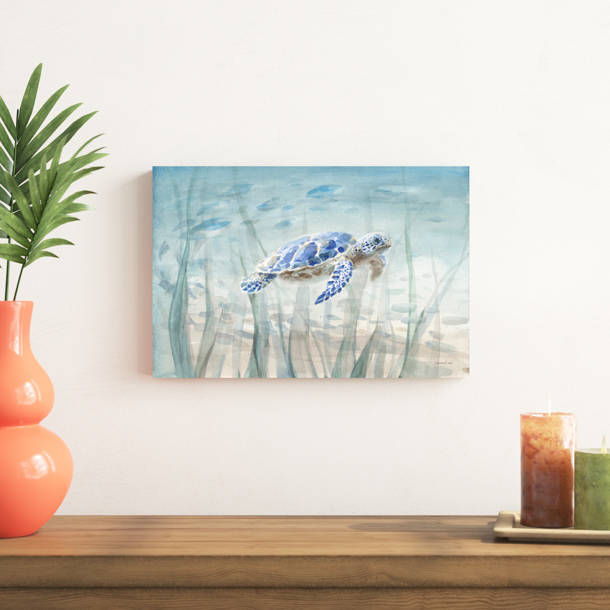
Where is `table`? table is located at coordinates (217, 553).